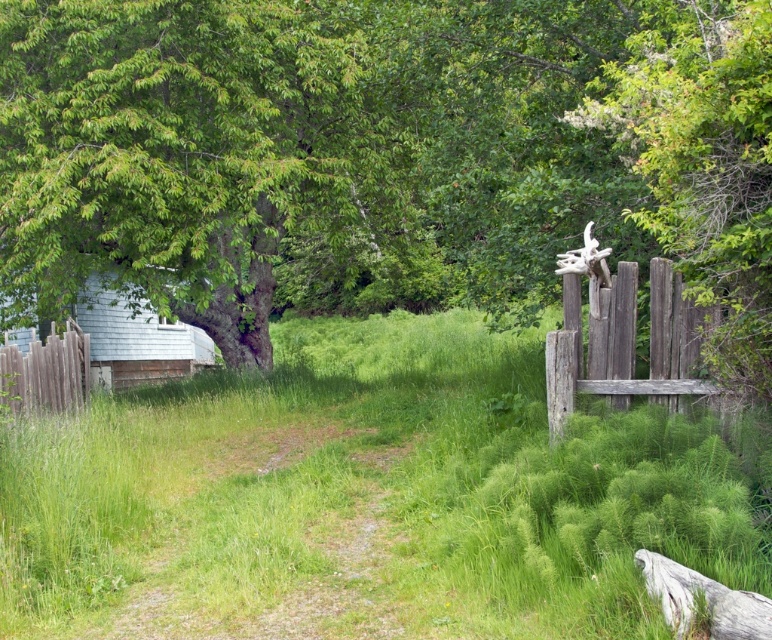
Question: Which object is farther from the camera taking this photo?

Choices:
 (A) gray rough log at lower right
 (B) green grassy at center

Answer: (B)

Question: Does green grassy at center appear over brown wooden fence at left?

Choices:
 (A) no
 (B) yes

Answer: (A)

Question: Which object appears closest to the camera in this image?

Choices:
 (A) green leafy tree at upper left
 (B) green grassy at center
 (C) brown wooden fence at left
 (D) white wood hut at left

Answer: (B)

Question: Does brown wooden fence at left have a larger size compared to gray rough log at lower right?

Choices:
 (A) yes
 (B) no

Answer: (A)

Question: Can you confirm if white wood hut at left is smaller than gray rough log at lower right?

Choices:
 (A) yes
 (B) no

Answer: (B)

Question: Which of the following is the farthest from the observer?

Choices:
 (A) (422, 48)
 (B) (669, 625)
 (C) (7, 376)
 (D) (156, 314)

Answer: (D)